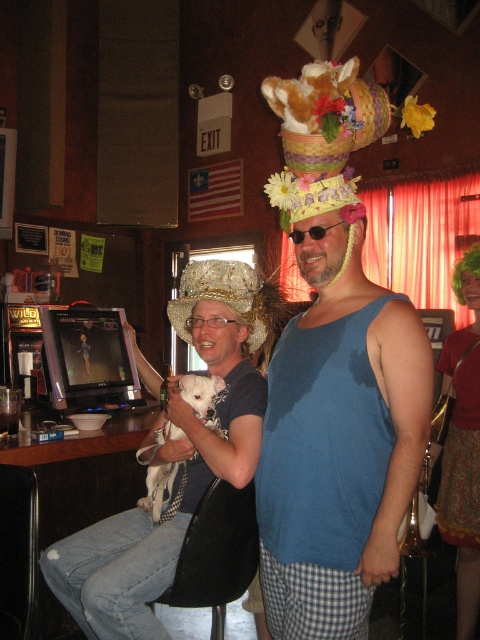
Who is shorter, white fur dog at center or green fabric hat at center?

Standing shorter between the two is green fabric hat at center.

Can you confirm if white fur dog at center is taller than green fabric hat at center?

Indeed, white fur dog at center has a greater height compared to green fabric hat at center.

Find the location of a particular element. white fur dog at center is located at coordinates (202, 396).

Does green fabric dress at lower right have a larger size compared to white fur dog at center?

Yes.

Between point (479, 540) and point (180, 499), which one is positioned behind?

The point (479, 540) is behind.

What are the coordinates of `green fabric dress at lower right` in the screenshot? It's located at (463, 445).

Is fuzzy white dog at center taller than green fabric dress at lower right?

In fact, fuzzy white dog at center may be shorter than green fabric dress at lower right.

Who is higher up, fuzzy white dog at center or green fabric dress at lower right?

Positioned higher is fuzzy white dog at center.

This screenshot has height=640, width=480. I want to click on fuzzy white dog at center, so click(x=172, y=461).

Locate an element on the screen. Image resolution: width=480 pixels, height=640 pixels. fuzzy white dog at center is located at coordinates (172, 461).